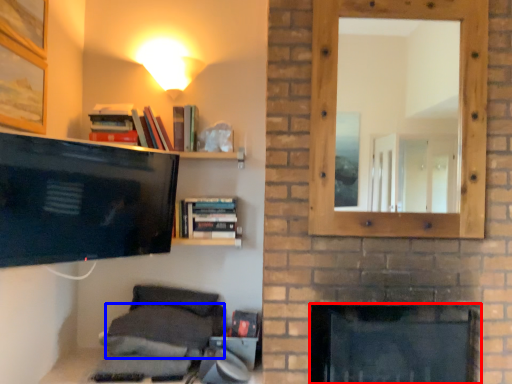
Question: Which object appears farthest to the camera in this image, fireplace (highlighted by a red box) or pillow (highlighted by a blue box)?

Choices:
 (A) fireplace
 (B) pillow

Answer: (B)